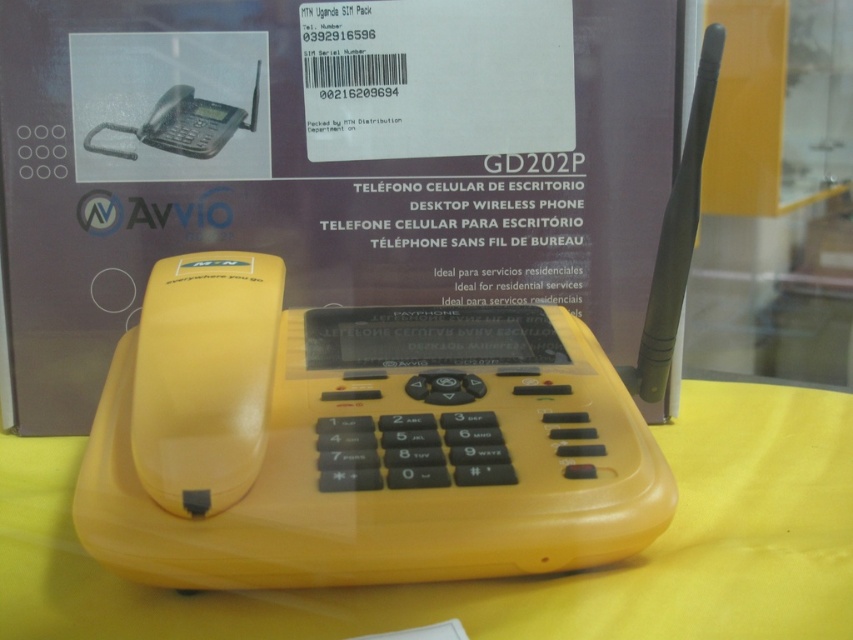
You are a customer comparing two phones in a store. You see the yellow plastic phone at center and the matte black phone at upper left. Which one is wider?

The yellow plastic phone at center is wider than the matte black phone at upper left.

You are a customer at a electronics store and see the yellow plastic phone at center and the matte black phone at upper left. Which phone is located more to the right side?

The yellow plastic phone at center is positioned on the right side of matte black phone at upper left, so it is more to the right.

You are setting up a desk and want to place the yellow plastic phone at center and the matte black phone at upper left in a way that follows the image. Which phone should be placed higher on the desk?

The matte black phone at upper left should be placed higher on the desk because the yellow plastic phone at center is located below it in the image.